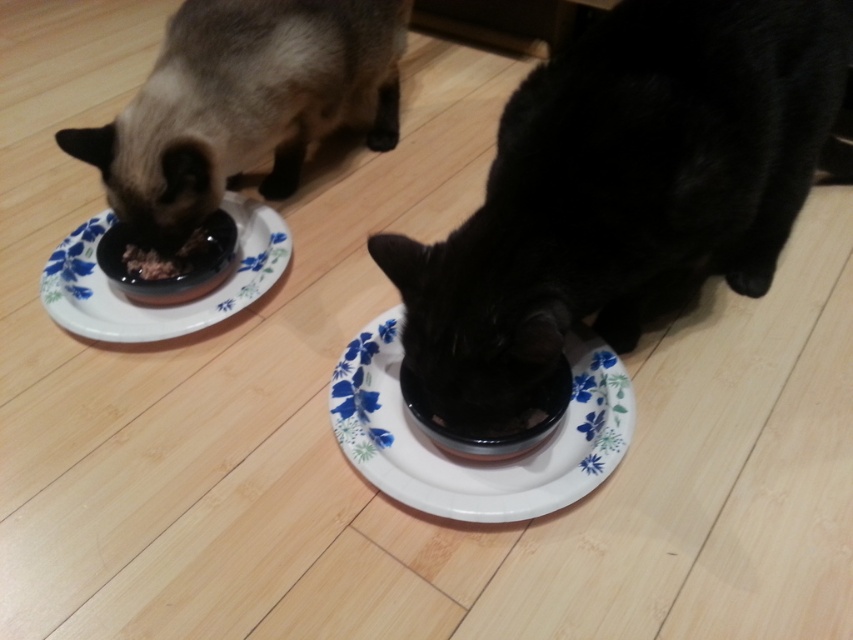
Can you confirm if black glossy bowl at lower center is positioned to the left of white glossy plate at center?

In fact, black glossy bowl at lower center is to the right of white glossy plate at center.

Is black glossy bowl at lower center bigger than white glossy plate at center?

Yes.

Identify the location of black glossy bowl at lower center. This screenshot has height=640, width=853. (624, 189).

In the scene shown: Does silky brown fur cat at left appear over white glossy plate at center?

Indeed, silky brown fur cat at left is positioned over white glossy plate at center.

Find the location of a particular element. silky brown fur cat at left is located at coordinates pyautogui.click(x=244, y=104).

Between point (489, 516) and point (207, 237), which one is positioned in front?

Positioned in front is point (489, 516).

Who is positioned more to the left, white glossy plate at center or brown matte food at left?

From the viewer's perspective, brown matte food at left appears more on the left side.

Who is more forward, (410,428) or (207,227)?

Point (410,428) is more forward.

Identify the location of white glossy plate at center. The height and width of the screenshot is (640, 853). (474, 461).